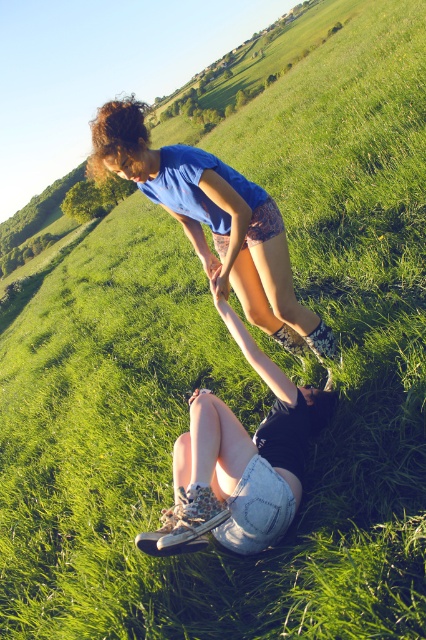
Can you confirm if blue fabric shorts at center is bigger than denim shorts at center?

Correct, blue fabric shorts at center is larger in size than denim shorts at center.

Between point (198, 150) and point (287, 502), which one is positioned in front?

Point (287, 502) is more forward.

At what (x,y) coordinates should I click in order to perform the action: click on blue fabric shorts at center. Please return your answer as a coordinate pair (x, y). This screenshot has height=640, width=426. Looking at the image, I should click on (213, 221).